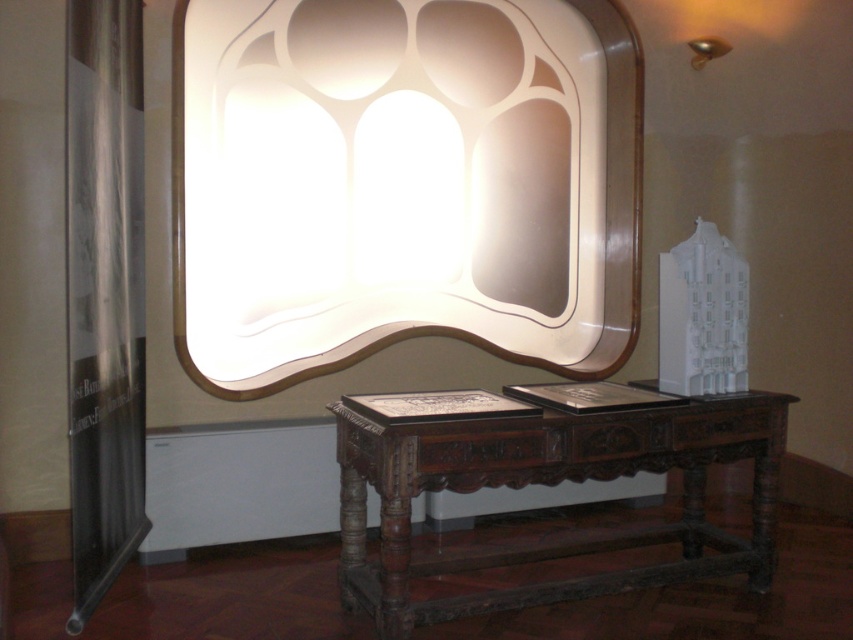
Is dark brown wood table at center thinner than metallic gold lamp at upper right?

In fact, dark brown wood table at center might be wider than metallic gold lamp at upper right.

Can you confirm if dark brown wood table at center is bigger than metallic gold lamp at upper right?

Correct, dark brown wood table at center is larger in size than metallic gold lamp at upper right.

Does point (728, 563) come behind point (699, 68)?

No, (728, 563) is closer to viewer.

You are a GUI agent. You are given a task and a screenshot of the screen. Output one action in this format:
    pyautogui.click(x=<x>, y=<y>)
    Task: Click on the dark brown wood table at center
    
    Given the screenshot: What is the action you would take?
    pyautogui.click(x=549, y=483)

Which of these two, white glossy mirror at upper center or metallic gold lamp at upper right, stands taller?

Standing taller between the two is white glossy mirror at upper center.

Between white glossy mirror at upper center and metallic gold lamp at upper right, which one is positioned higher?

Positioned higher is metallic gold lamp at upper right.

You are a GUI agent. You are given a task and a screenshot of the screen. Output one action in this format:
    pyautogui.click(x=<x>, y=<y>)
    Task: Click on the white glossy mirror at upper center
    This screenshot has width=853, height=640.
    Given the screenshot: What is the action you would take?
    pyautogui.click(x=403, y=182)

I want to click on white glossy mirror at upper center, so click(403, 182).

Identify the location of white glossy mirror at upper center. This screenshot has width=853, height=640. (403, 182).

Who is lower down, white glossy mirror at upper center or dark brown wood table at center?

dark brown wood table at center is lower down.

Who is more forward, (474, 109) or (764, 525)?

Point (764, 525) is in front.

This screenshot has height=640, width=853. I want to click on white glossy mirror at upper center, so click(x=403, y=182).